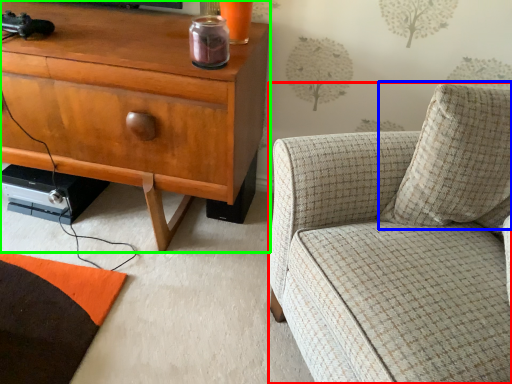
Question: Based on their relative distances, which object is farther from chair (highlighted by a red box)? Choose from pillow (highlighted by a blue box) and cabinetry (highlighted by a green box).

Choices:
 (A) pillow
 (B) cabinetry

Answer: (B)